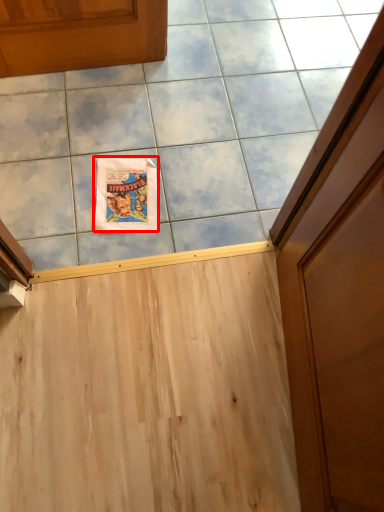
Question: From the image's perspective, considering the relative positions of comic book (annotated by the red box) and ceramic tile in the image provided, where is comic book (annotated by the red box) located with respect to the staircase?

Choices:
 (A) below
 (B) above

Answer: (A)